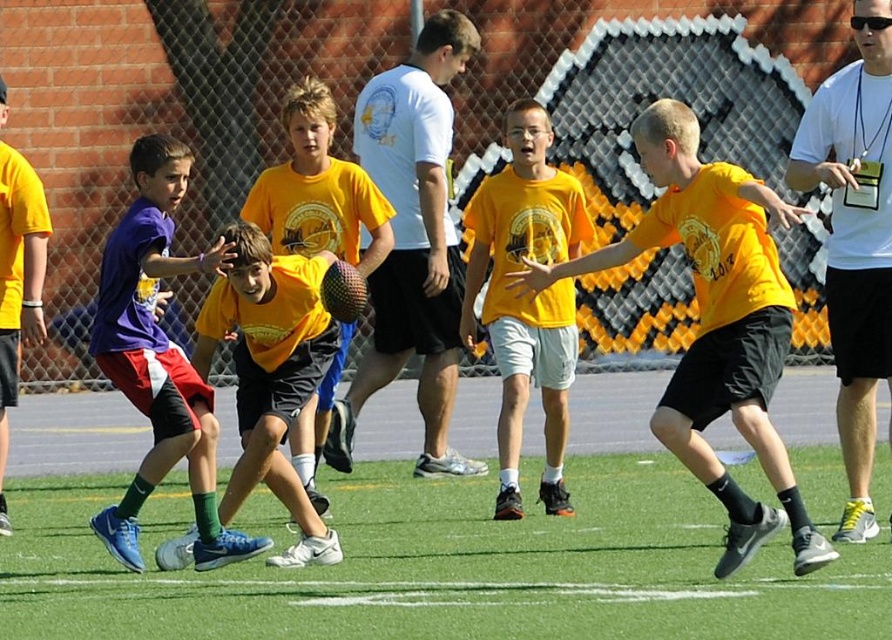
Does purple matte shirt at left have a greater height compared to yellow matte shirt at center?

In fact, purple matte shirt at left may be shorter than yellow matte shirt at center.

Is purple matte shirt at left above yellow matte shirt at center?

No.

Does point (168, 177) come in front of point (502, 216)?

Yes, it is in front of point (502, 216).

The image size is (892, 640). Identify the location of purple matte shirt at left. (159, 358).

Who is more forward, (509, 122) or (287, 188)?

Point (509, 122)

How much distance is there between yellow matte shirt at center and matte yellow shirt at center?

yellow matte shirt at center and matte yellow shirt at center are 4.32 feet apart from each other.

Between point (473, 211) and point (344, 336), which one is positioned behind?

Positioned behind is point (344, 336).

This screenshot has height=640, width=892. Identify the location of yellow matte shirt at center. (527, 298).

This screenshot has height=640, width=892. What do you see at coordinates (447, 566) in the screenshot? I see `green artificial turf at center` at bounding box center [447, 566].

From the picture: Between green artificial turf at center and white t-shirt at upper right, which one appears on the left side from the viewer's perspective?

green artificial turf at center

Which is in front, point (38, 618) or point (852, 248)?

Positioned in front is point (38, 618).

You are a GUI agent. You are given a task and a screenshot of the screen. Output one action in this format:
    pyautogui.click(x=<x>, y=<y>)
    Task: Click on the green artificial turf at center
    Image resolution: width=892 pixels, height=640 pixels.
    Given the screenshot: What is the action you would take?
    pyautogui.click(x=447, y=566)